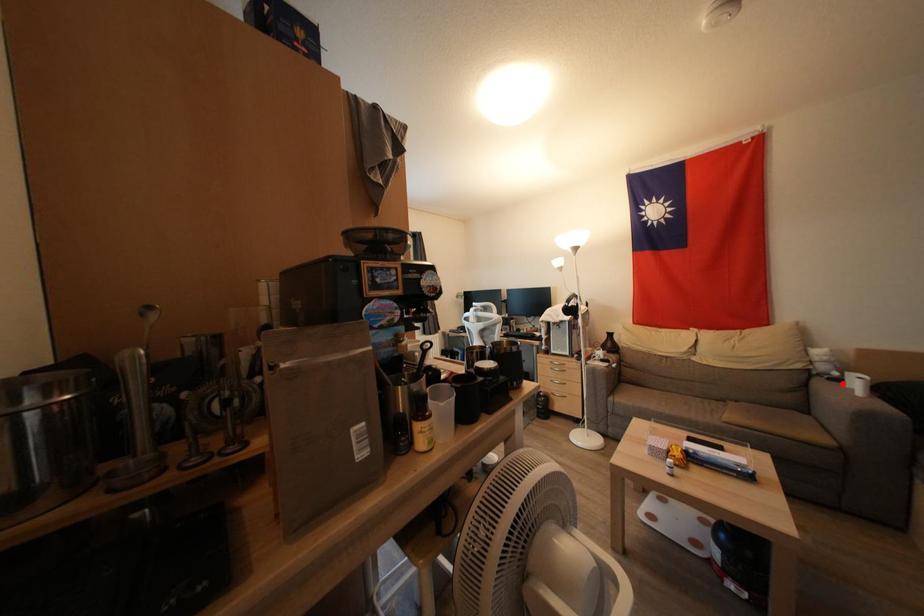
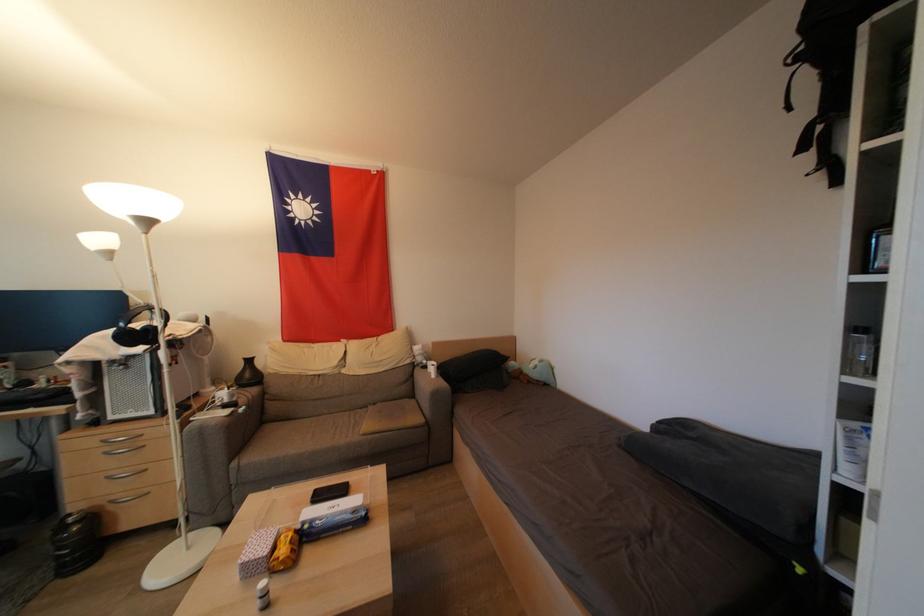
In the second image, find the point that corresponds to the highlighted location in the first image.

(430, 371)